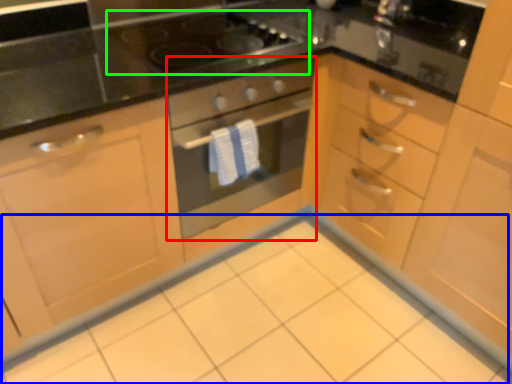
Question: Estimate the real-world distances between objects in this image. Which object is farther from oven (highlighted by a red box), ceramic tile (highlighted by a blue box) or gas stove (highlighted by a green box)?

Choices:
 (A) ceramic tile
 (B) gas stove

Answer: (A)